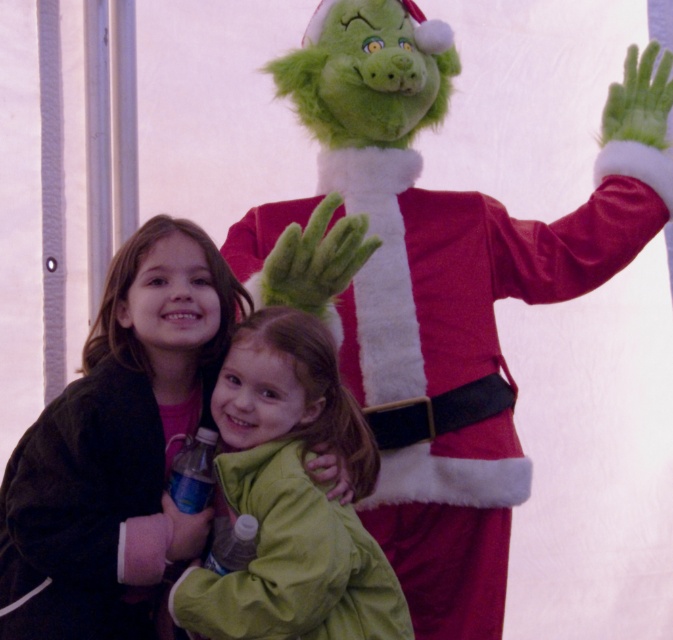
Question: Which of these objects is positioned closest to the fuzzy red santa at center?

Choices:
 (A) matte green jacket at center
 (B) green fuzzy coat at center

Answer: (B)

Question: Is matte green jacket at center closer to camera compared to green fuzzy coat at center?

Choices:
 (A) no
 (B) yes

Answer: (A)

Question: Where is matte green jacket at center located in relation to green fuzzy coat at center in the image?

Choices:
 (A) above
 (B) below

Answer: (A)

Question: Which is nearer to the matte green jacket at center?

Choices:
 (A) fuzzy red santa at center
 (B) green fuzzy coat at center

Answer: (B)

Question: Which object is farther from the camera taking this photo?

Choices:
 (A) green fuzzy coat at center
 (B) fuzzy red santa at center

Answer: (B)

Question: In this image, where is matte green jacket at center located relative to green fuzzy coat at center?

Choices:
 (A) right
 (B) left

Answer: (B)